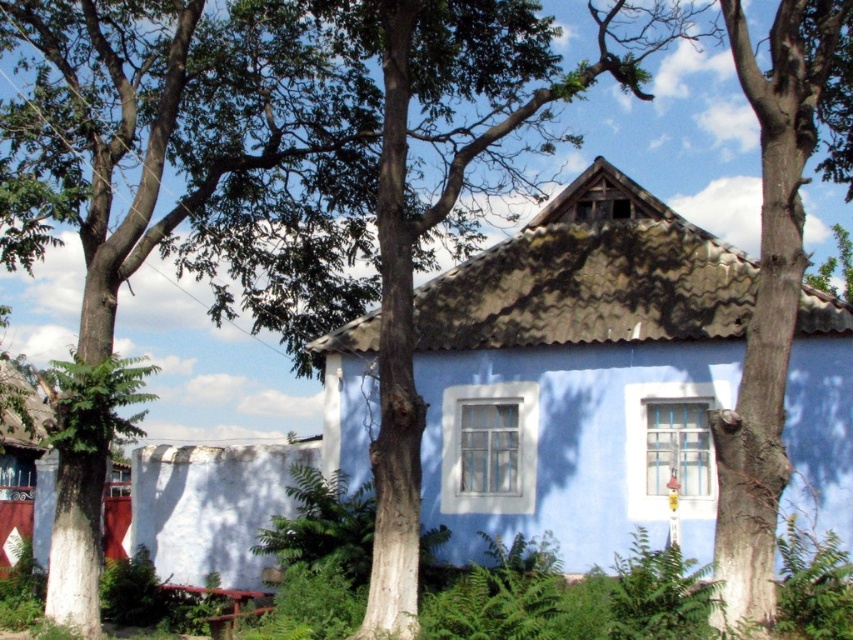
Question: Which of the following is the closest to the observer?

Choices:
 (A) (170, 480)
 (B) (3, 536)
 (C) (573, 460)

Answer: (C)

Question: Which of the following is the closest to the observer?

Choices:
 (A) blue corrugated metal hut at center
 (B) wooden picnic table at lower left

Answer: (A)

Question: Is white painted wood hut at left to the right of wooden picnic table at lower left from the viewer's perspective?

Choices:
 (A) no
 (B) yes

Answer: (A)

Question: Can you confirm if smooth bark tree trunk at right is positioned below white rough wall at lower left?

Choices:
 (A) no
 (B) yes

Answer: (A)

Question: Which point appears farthest from the camera in this image?

Choices:
 (A) (732, 330)
 (B) (19, 440)
 (C) (814, 54)
 (D) (184, 452)

Answer: (B)

Question: Is smooth bark tree trunk at right in front of white painted wood hut at left?

Choices:
 (A) yes
 (B) no

Answer: (A)